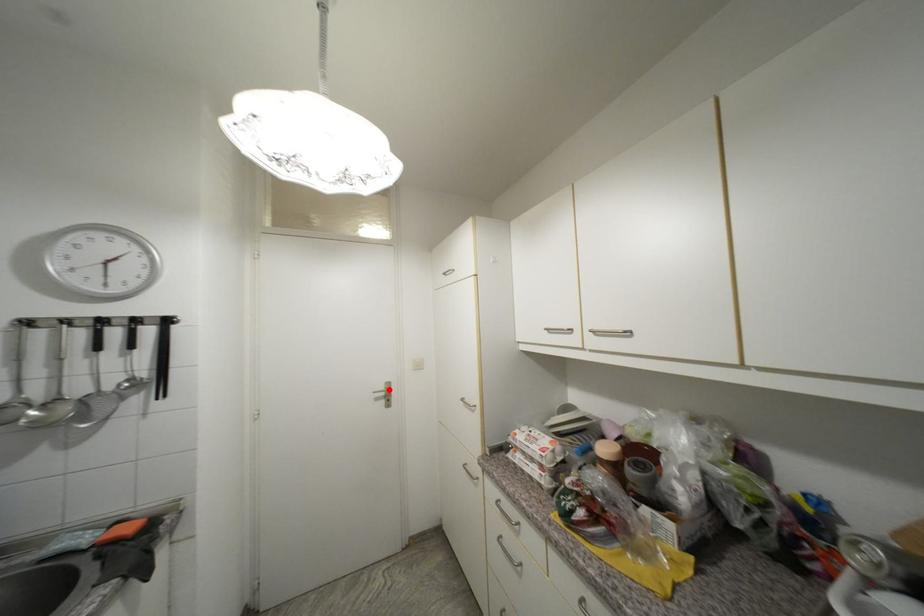
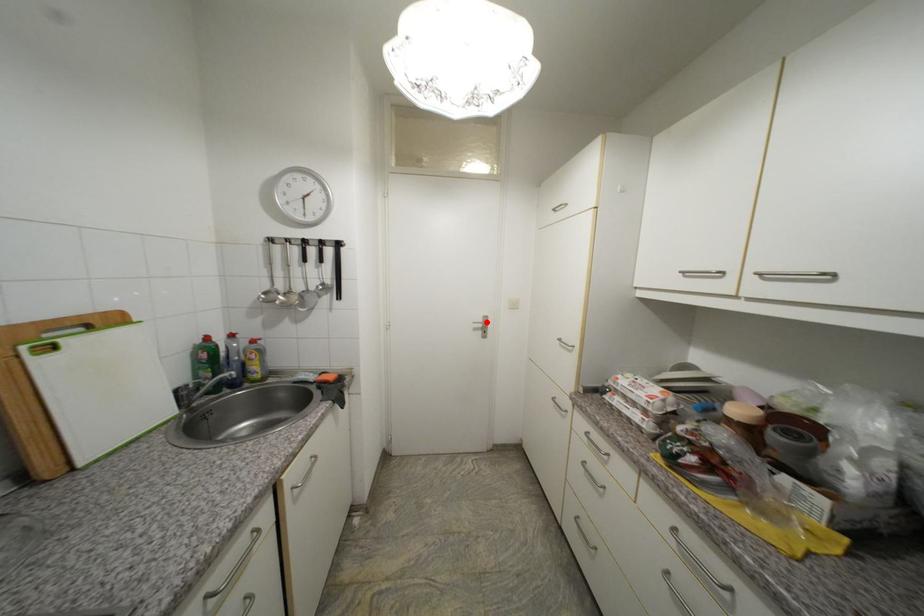
I am providing you with two images of the same scene from different viewpoints. A red point is marked on the first image and another point is marked on the second image. Is the marked point in image1 the same physical position as the marked point in image2?

Yes